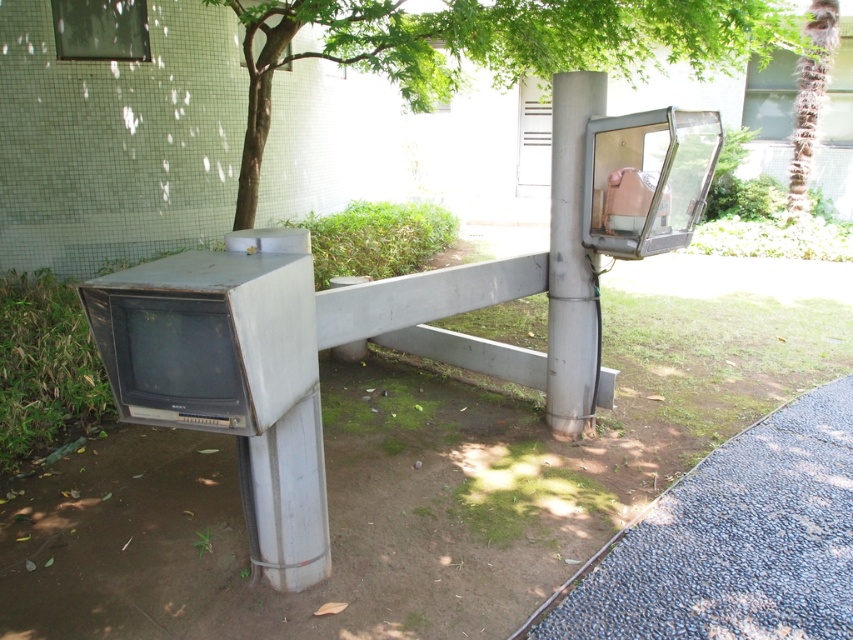
Does gray gravel at lower right appear on the right side of silver metallic pillar at lower left?

Indeed, gray gravel at lower right is positioned on the right side of silver metallic pillar at lower left.

Is gray gravel at lower right taller than silver metallic pillar at lower left?

No.

Does point (840, 572) come farther from viewer compared to point (315, 480)?

Yes, it is.

This screenshot has height=640, width=853. Find the location of `gray gravel at lower right`. gray gravel at lower right is located at coordinates (x=730, y=541).

Which of these two, silver metallic pillar at lower left or metallic gray pole at upper center, stands shorter?

silver metallic pillar at lower left

Between silver metallic pillar at lower left and metallic gray pole at upper center, which one has more height?

With more height is metallic gray pole at upper center.

Is point (323, 474) positioned before point (561, 177)?

Yes, it is.

Find the location of a particular element. Image resolution: width=853 pixels, height=640 pixels. silver metallic pillar at lower left is located at coordinates (286, 497).

Which is in front, point (265, 442) or point (834, 19)?

Point (265, 442) is in front.

Who is more distant from viewer, (317, 547) or (809, 29)?

The point (809, 29) is more distant.

Describe the element at coordinates (286, 497) in the screenshot. I see `silver metallic pillar at lower left` at that location.

What are the coordinates of `silver metallic pillar at lower left` in the screenshot? It's located at (286, 497).